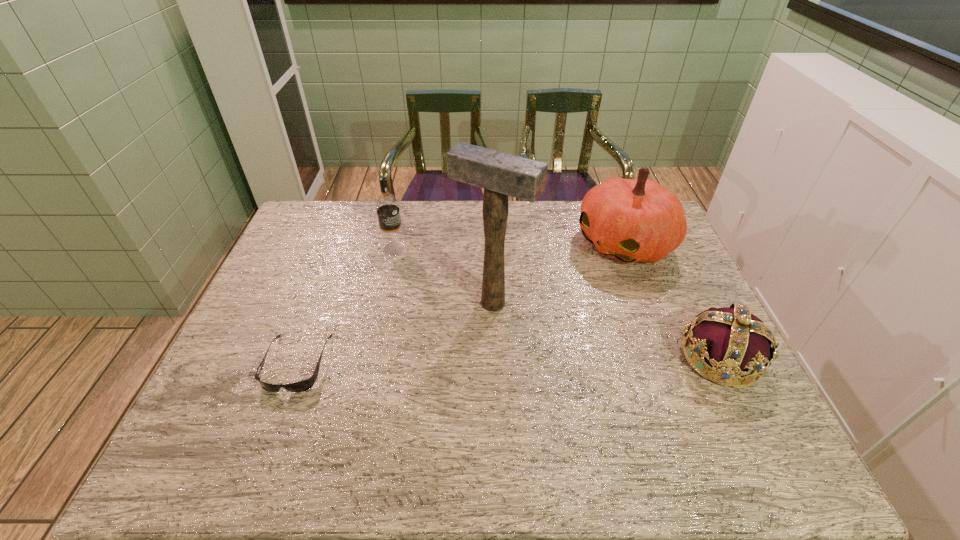
Locate an element on the screen. This screenshot has width=960, height=540. sunglasses at the near edge is located at coordinates (304, 385).

In order to click on crown located in the near edge section of the desktop in this screenshot , I will do `click(735, 342)`.

You are a GUI agent. You are given a task and a screenshot of the screen. Output one action in this format:
    pyautogui.click(x=<x>, y=<y>)
    Task: Click on the object located in the left edge section of the desktop
    
    Given the screenshot: What is the action you would take?
    pyautogui.click(x=304, y=385)

At what (x,y) coordinates should I click in order to perform the action: click on crown located at the right edge. Please return your answer as a coordinate pair (x, y). Looking at the image, I should click on (735, 342).

In order to click on pumpkin that is at the right edge in this screenshot , I will do `click(633, 220)`.

In order to click on object located at the near left corner in this screenshot , I will do `click(304, 385)`.

Find the location of a particular element. Image resolution: width=960 pixels, height=540 pixels. object at the far right corner is located at coordinates (633, 220).

Locate an element on the screen. This screenshot has height=540, width=960. object situated at the near right corner is located at coordinates (735, 342).

Find the location of a particular element. free space at the far edge of the desktop is located at coordinates (578, 230).

Locate an element on the screen. The image size is (960, 540). vacant space at the near edge of the desktop is located at coordinates (418, 411).